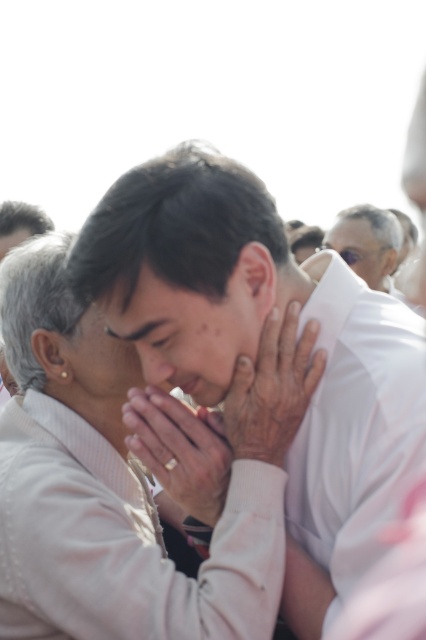
Question: Based on their relative distances, which object is nearer to the white matte shirt at center?

Choices:
 (A) white matte hands at center
 (B) matte white face at upper right
 (C) white matte shirt at upper right
 (D) smooth skin hand at center

Answer: (D)

Question: Which object is positioned farthest from the smooth skin hand at center?

Choices:
 (A) white matte shirt at center
 (B) matte white face at upper right
 (C) smooth skin face at center

Answer: (B)

Question: Which object is the closest to the white matte shirt at center?

Choices:
 (A) smooth skin hand at center
 (B) white matte hands at center
 (C) smooth skin face at center

Answer: (C)

Question: Is smooth skin face at center bigger than matte white face at upper right?

Choices:
 (A) no
 (B) yes

Answer: (A)

Question: Is smooth skin face at center above white matte shirt at upper right?

Choices:
 (A) yes
 (B) no

Answer: (B)

Question: Is smooth skin face at center thinner than smooth skin hand at center?

Choices:
 (A) no
 (B) yes

Answer: (A)